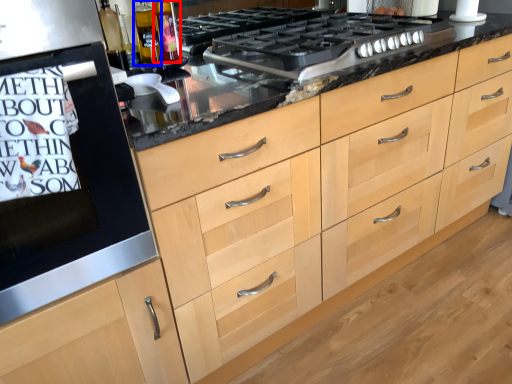
Question: Which object is further to the camera taking this photo, bottle (highlighted by a red box) or bottle (highlighted by a blue box)?

Choices:
 (A) bottle
 (B) bottle

Answer: (A)